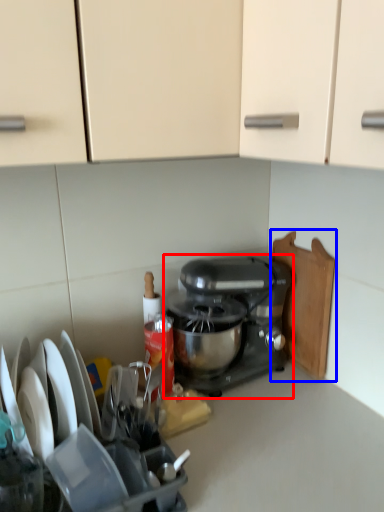
Question: Which point is closer to the camera, mixer (highlighted by a red box) or cutting board (highlighted by a blue box)?

Choices:
 (A) mixer
 (B) cutting board

Answer: (A)